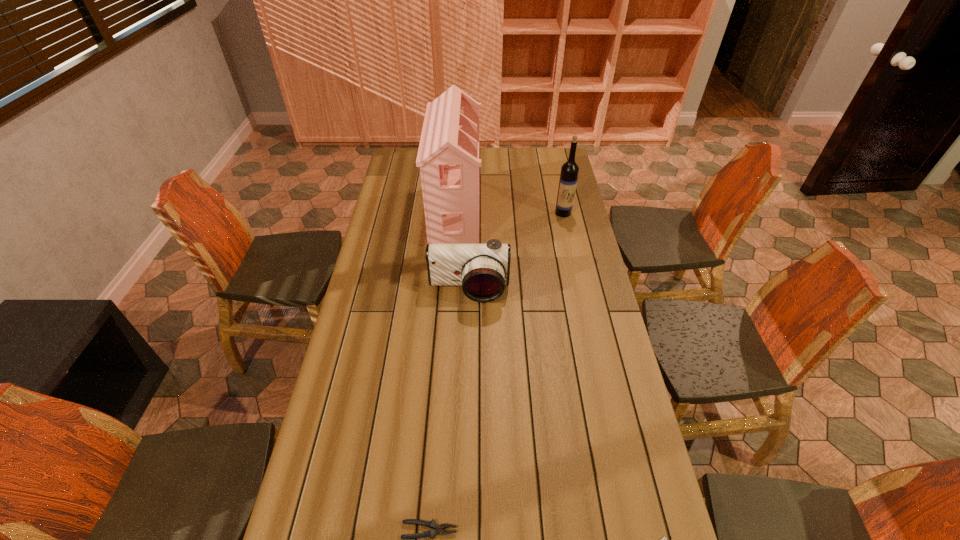
What are the coordinates of `the tallest object` in the screenshot? It's located at (448, 156).

Where is `wine bottle`? This screenshot has height=540, width=960. wine bottle is located at coordinates (569, 171).

Image resolution: width=960 pixels, height=540 pixels. Identify the location of camcorder. (483, 270).

Find the location of a particular element. The width and height of the screenshot is (960, 540). the third tallest object is located at coordinates (483, 270).

The image size is (960, 540). Find the location of `vacant point located 0.080m on the front-facing side of the dollhouse`. vacant point located 0.080m on the front-facing side of the dollhouse is located at coordinates (499, 213).

Locate an element on the screen. The height and width of the screenshot is (540, 960). vacant space situated on the label of the wine bottle is located at coordinates (572, 253).

Where is `free space located on the surface of the camcorder`? Image resolution: width=960 pixels, height=540 pixels. free space located on the surface of the camcorder is located at coordinates (467, 352).

This screenshot has width=960, height=540. In order to click on object that is at the right edge in this screenshot , I will do `click(569, 171)`.

In the image, there is a desktop. Where is `vacant region at the far edge`? The width and height of the screenshot is (960, 540). vacant region at the far edge is located at coordinates (518, 159).

You are a GUI agent. You are given a task and a screenshot of the screen. Output one action in this format:
    pyautogui.click(x=<x>, y=<y>)
    Task: Click on the vacant point at the left edge
    The width and height of the screenshot is (960, 540).
    Given the screenshot: What is the action you would take?
    pyautogui.click(x=372, y=447)